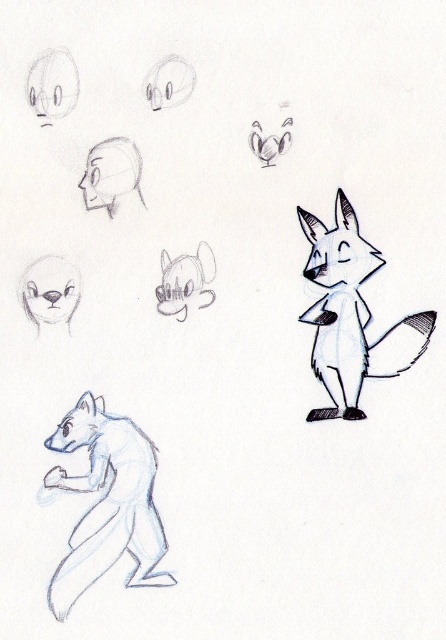
Is point (132, 438) positioned in front of point (292, 124)?

No, (132, 438) is behind (292, 124).

Is white fur fox at lower left in front of smooth gray fox at upper center?

Yes, white fur fox at lower left is in front of smooth gray fox at upper center.

Locate an element on the screen. white fur fox at lower left is located at coordinates (107, 502).

You are a GUI agent. You are given a task and a screenshot of the screen. Output one action in this format:
    pyautogui.click(x=<x>, y=<y>)
    Task: Click on the white fur fox at lower left
    This screenshot has width=446, height=640.
    Given the screenshot: What is the action you would take?
    pyautogui.click(x=107, y=502)

The image size is (446, 640). What do you see at coordinates (107, 502) in the screenshot?
I see `white fur fox at lower left` at bounding box center [107, 502].

Does point (95, 515) lie behind point (115, 195)?

No, (95, 515) is closer to viewer.

What are the coordinates of `white fur fox at lower left` in the screenshot? It's located at (107, 502).

Can you confirm if white fur fox at lower left is bigger than smooth gray fox at center?

Indeed, white fur fox at lower left has a larger size compared to smooth gray fox at center.

Does white fur fox at lower left have a lesser width compared to smooth gray fox at center?

No.

The height and width of the screenshot is (640, 446). In order to click on white fur fox at lower left in this screenshot , I will do `click(107, 502)`.